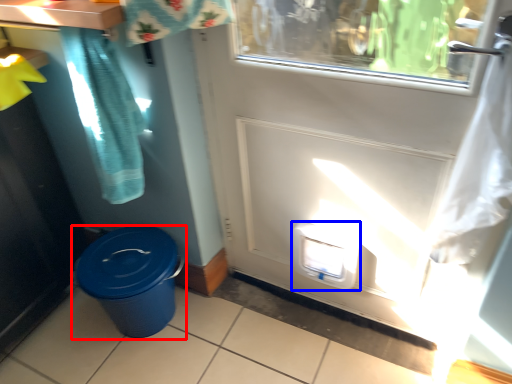
Question: Which object appears farthest to the camera in this image, waste container (highlighted by a red box) or water cooler (highlighted by a blue box)?

Choices:
 (A) waste container
 (B) water cooler

Answer: (A)